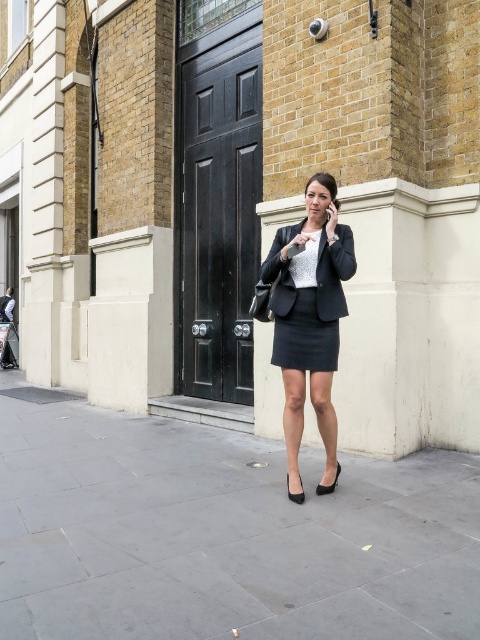
You are a delivery person trying to place a package on the ground between the gray concrete pavement at center and the matte black skirt at center. Can you fit the package there?

The gray concrete pavement at center is to the left of matte black skirt at center, so there is space between them. The package can be placed there.

From the picture: You are a delivery person trying to place a package on the gray concrete pavement at center. However, you notice the matte black blazer at center is already occupying the space. Can the package be placed there without moving the blazer?

The gray concrete pavement at center is not as tall as the matte black blazer at center, meaning the blazer is taller than the pavement. Since the pavement is lower, the package can be placed on the gray concrete pavement at center without needing to move the blazer as they occupy different vertical spaces.

You are standing at the entrance of the building and want to place a small potted plant on the gray concrete pavement at center. According to the image, where exactly should you place it?

The gray concrete pavement at center is located at point (224,534), so you should place the potted plant at those coordinates on the gray concrete pavement at center.